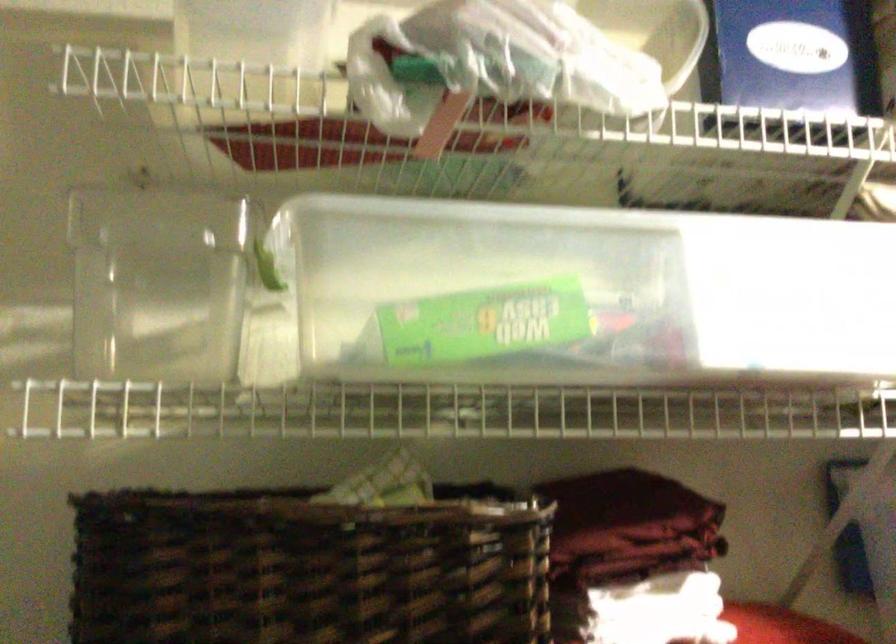
Image resolution: width=896 pixels, height=644 pixels. Describe the element at coordinates (484, 322) in the screenshot. I see `the green container latch` at that location.